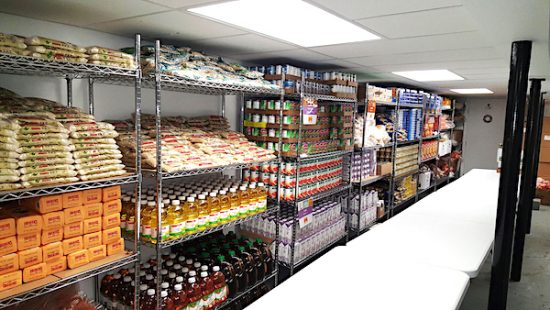
Find the location of `support beams`. support beams is located at coordinates (514, 123), (529, 134).